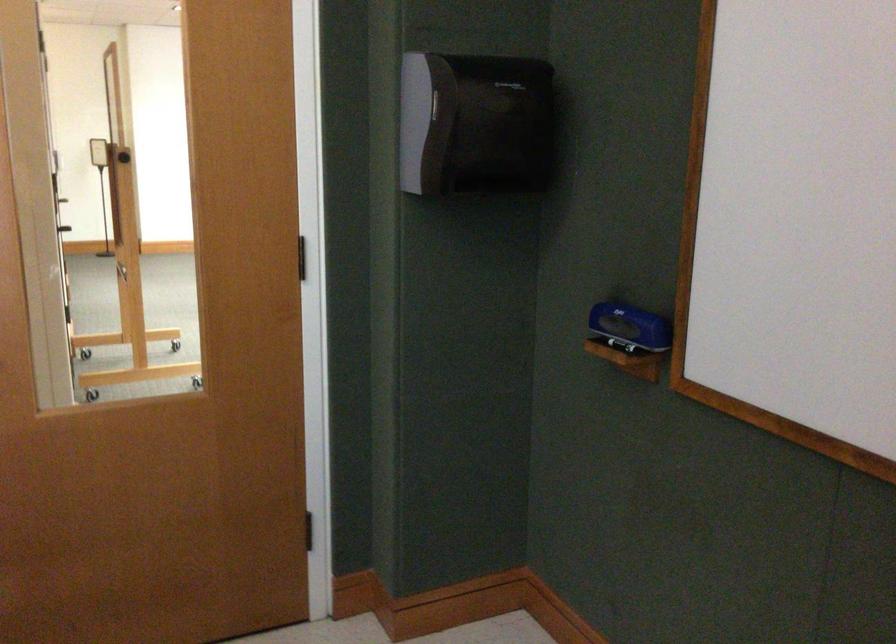
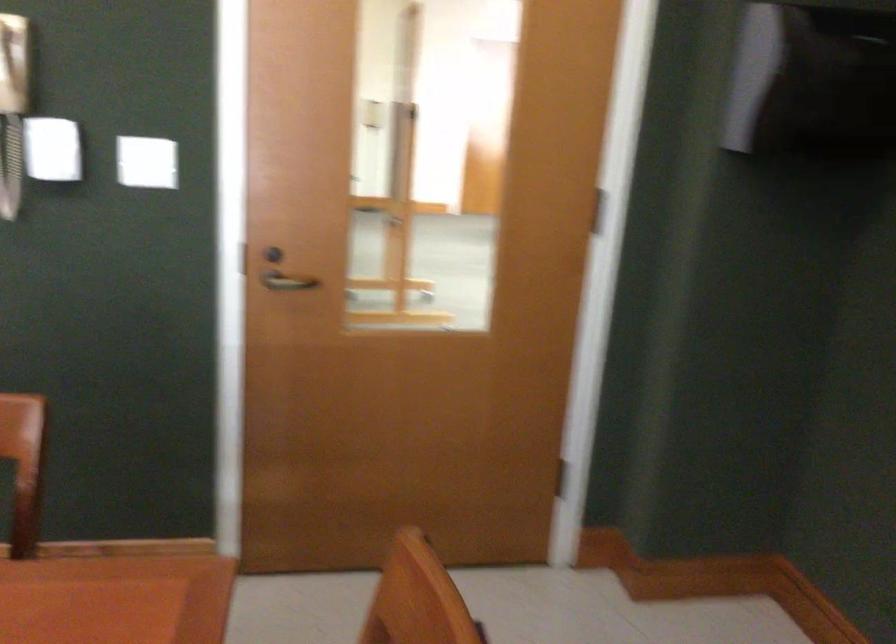
Question: The first image is from the beginning of the video and the second image is from the end. How did the camera likely rotate when shooting the video?

Choices:
 (A) Left
 (B) Right
 (C) Up
 (D) Down

Answer: (A)